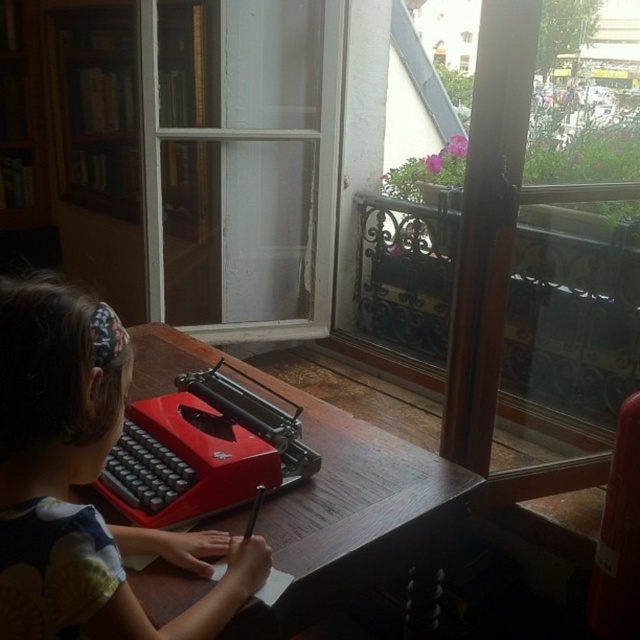
You are a photographer setting up a shoot in this room. You need to place a small lamp on the wooden table at center without blocking the matte black hairband at upper left. Is this possible?

The matte black hairband at upper left is positioned under the wooden table at center, so placing a lamp on the table won not block the hairband since it is underneath.

You are standing in the room and want to take a photo of the point at coordinates (60, 502). If your camera is 27.11 inches away from that point, is it within the recommended 30 inches focus range for clear photos?

The point at coordinates (60, 502) is 27.11 inches away from the camera, which is within the recommended 30 inches focus range for clear photos.